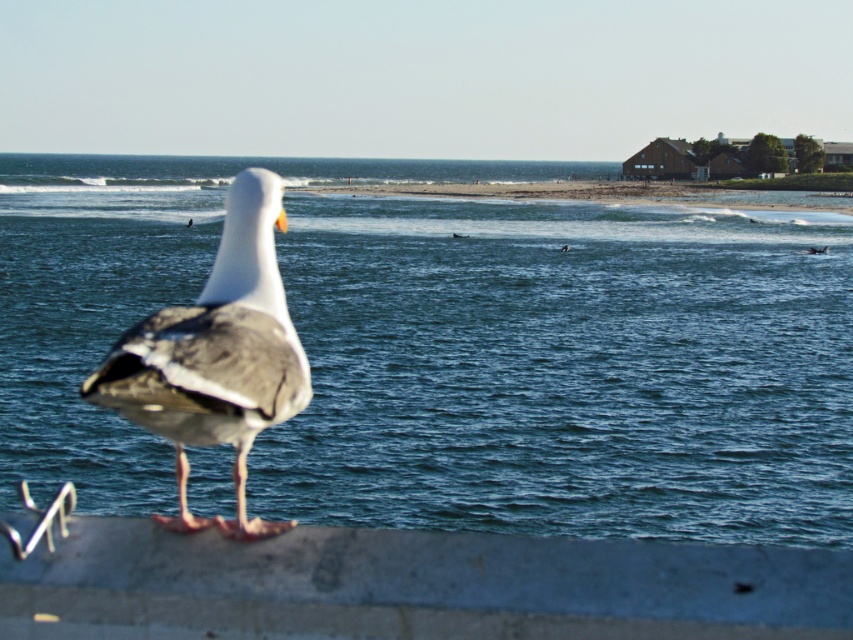
You are standing at the seagull and want to move towards the ocean. Which point, point (55, 378) or point (242, 426), is closer to you?

Point (55, 378) is closer to you because it is further to the viewer than point (242, 426), which means it is nearer in the scene.

You are a photographer standing at the edge of the gray concrete at lower center, aiming to capture the white matte seagull at center in your shot. Can you tell me which object is higher in the frame?

The white matte seagull at center is taller than the gray concrete at lower center, so it will appear higher in the frame.

You are a photographer trying to capture the seagull and the blue water at center. Based on their positions, where should you focus your camera to ensure both are in the frame?

The blue water at center is located at point (x=451, y=352), so you should focus your camera at that coordinate to include both the seagull and the blue water at center in the frame.